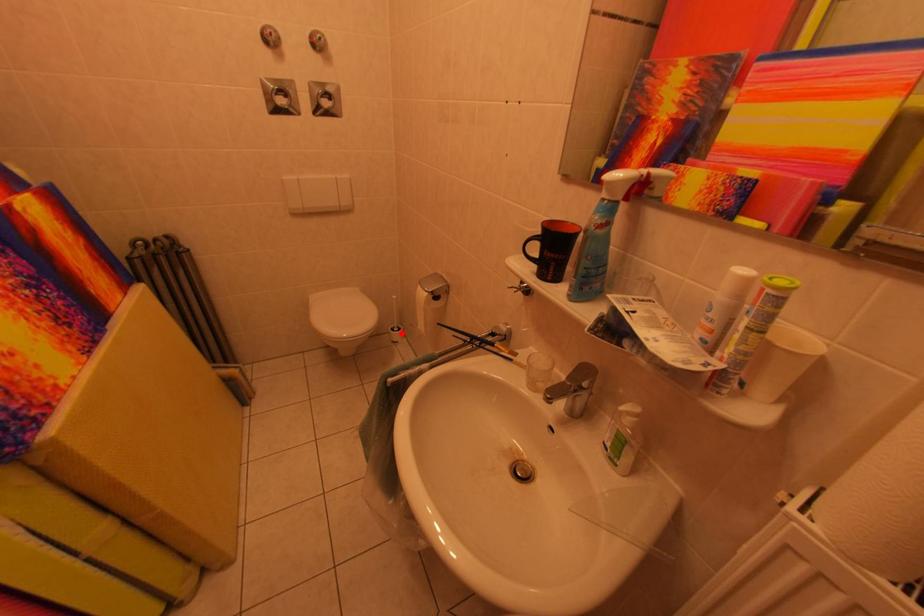
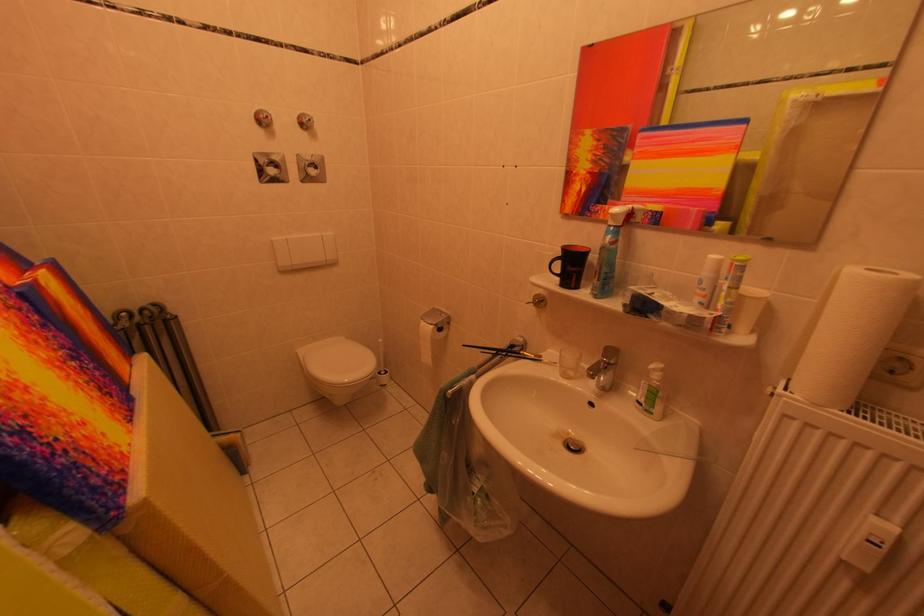
In the second image, find the point that corresponds to the highlighted location in the first image.

(388, 378)